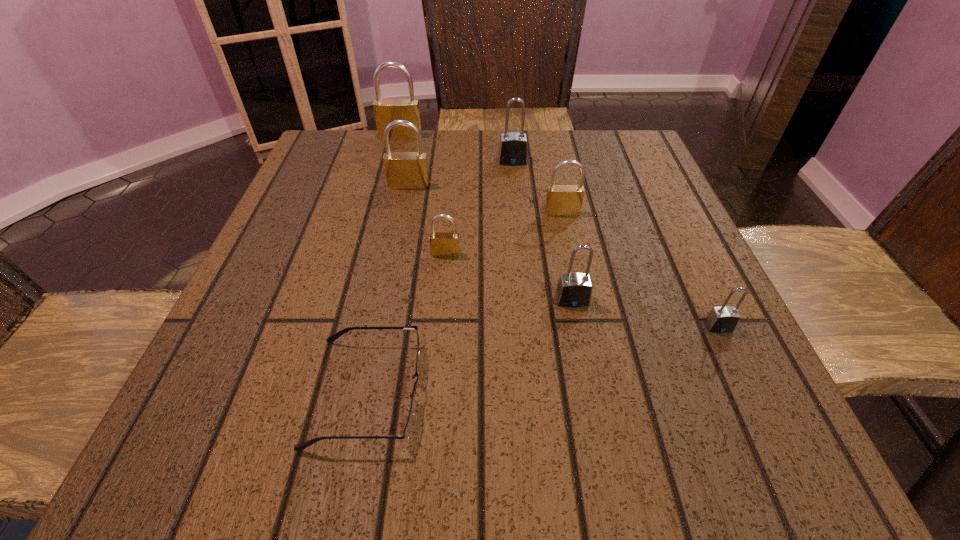
Where is `vacant space at the left edge of the desktop`? Image resolution: width=960 pixels, height=540 pixels. vacant space at the left edge of the desktop is located at coordinates (305, 353).

Locate an element on the screen. The width and height of the screenshot is (960, 540). free space at the right edge is located at coordinates (617, 266).

Image resolution: width=960 pixels, height=540 pixels. I want to click on free space at the far left corner of the desktop, so click(x=330, y=160).

Locate an element on the screen. The height and width of the screenshot is (540, 960). free space at the near right corner of the desktop is located at coordinates (701, 457).

This screenshot has width=960, height=540. Identify the location of free spot between the third farthest brass padlock and the spectacles. (465, 302).

Locate an element on the screen. The height and width of the screenshot is (540, 960). vacant area that lies between the farthest padlock and the sixth farthest padlock is located at coordinates (486, 218).

Where is `empty space between the third farthest object and the rightmost gray padlock`? This screenshot has width=960, height=540. empty space between the third farthest object and the rightmost gray padlock is located at coordinates (564, 256).

Locate an element on the screen. The image size is (960, 540). vacant space that's between the second farthest brass padlock and the rightmost padlock is located at coordinates (564, 256).

The image size is (960, 540). What are the coordinates of `blank region between the seventh farthest object and the second farthest gray padlock` in the screenshot? It's located at [645, 313].

Find the location of `vacant space that's between the fourth object from right to left and the nearest brass padlock`. vacant space that's between the fourth object from right to left and the nearest brass padlock is located at coordinates (479, 207).